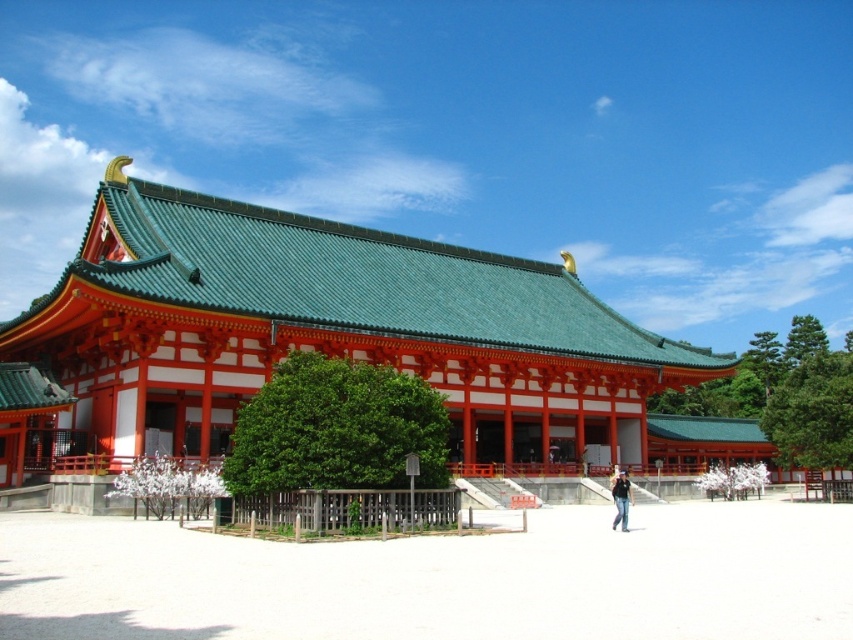
Question: Which of the following is the closest to the observer?

Choices:
 (A) black denim jeans at lower center
 (B) green leafy tree at right

Answer: (A)

Question: From the image, what is the correct spatial relationship of matte red wooden temple at center in relation to green leafy tree at center?

Choices:
 (A) left
 (B) right

Answer: (A)

Question: Considering the relative positions of green leafy tree at right and black denim jeans at lower center in the image provided, where is green leafy tree at right located with respect to black denim jeans at lower center?

Choices:
 (A) left
 (B) right

Answer: (B)

Question: Which object appears farthest from the camera in this image?

Choices:
 (A) green leafy tree at center
 (B) matte red wooden temple at center
 (C) black denim jeans at lower center
 (D) green leafy tree at right

Answer: (D)

Question: Observing the image, what is the correct spatial positioning of green leafy tree at center in reference to black denim jeans at lower center?

Choices:
 (A) right
 (B) left

Answer: (B)

Question: Which object is the closest to the matte red wooden temple at center?

Choices:
 (A) black denim jeans at lower center
 (B) green leafy tree at center

Answer: (B)